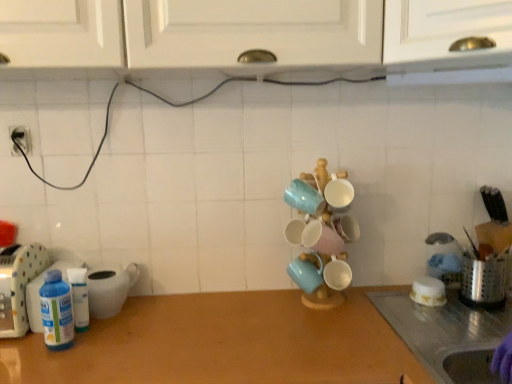
Where is `free location to the left of matte ceramic mugs at center, the second tableware viewed from the left`? The height and width of the screenshot is (384, 512). free location to the left of matte ceramic mugs at center, the second tableware viewed from the left is located at coordinates (265, 308).